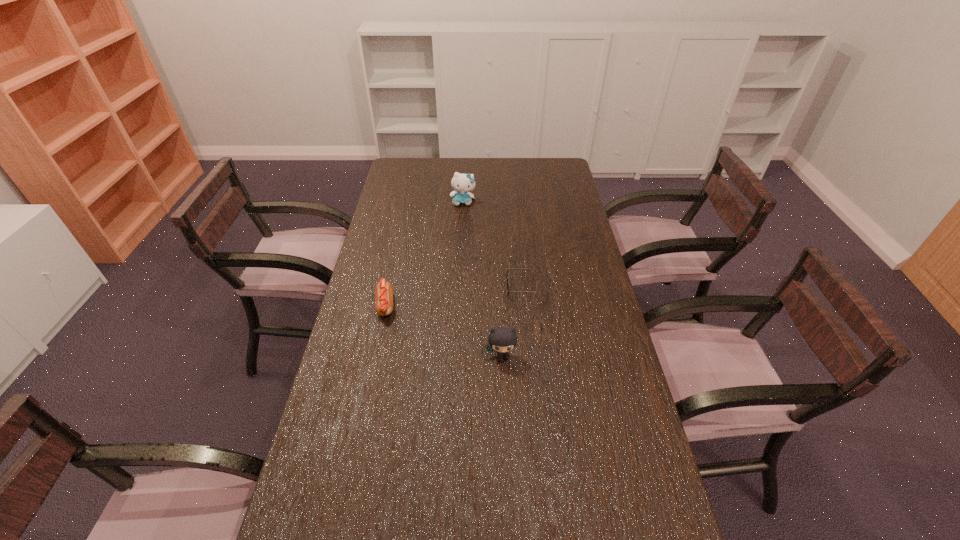
Where is `vacant position in the image that satisfies the following two spatial constraints: 1. through the lenses of the shortest object; 2. on the front-facing side of the nearest object`? The width and height of the screenshot is (960, 540). vacant position in the image that satisfies the following two spatial constraints: 1. through the lenses of the shortest object; 2. on the front-facing side of the nearest object is located at coordinates (533, 356).

The image size is (960, 540). What are the coordinates of `free region that satisfies the following two spatial constraints: 1. through the lenses of the spectacles; 2. on the front-facing side of the right kitten` in the screenshot? It's located at (533, 356).

At what (x,y) coordinates should I click in order to perform the action: click on free space that satisfies the following two spatial constraints: 1. through the lenses of the shortest object; 2. on the front-facing side of the third shortest object. Please return your answer as a coordinate pair (x, y). Looking at the image, I should click on (533, 356).

The width and height of the screenshot is (960, 540). Identify the location of free space that satisfies the following two spatial constraints: 1. through the lenses of the spectacles; 2. on the front-facing side of the third shortest object. 533,356.